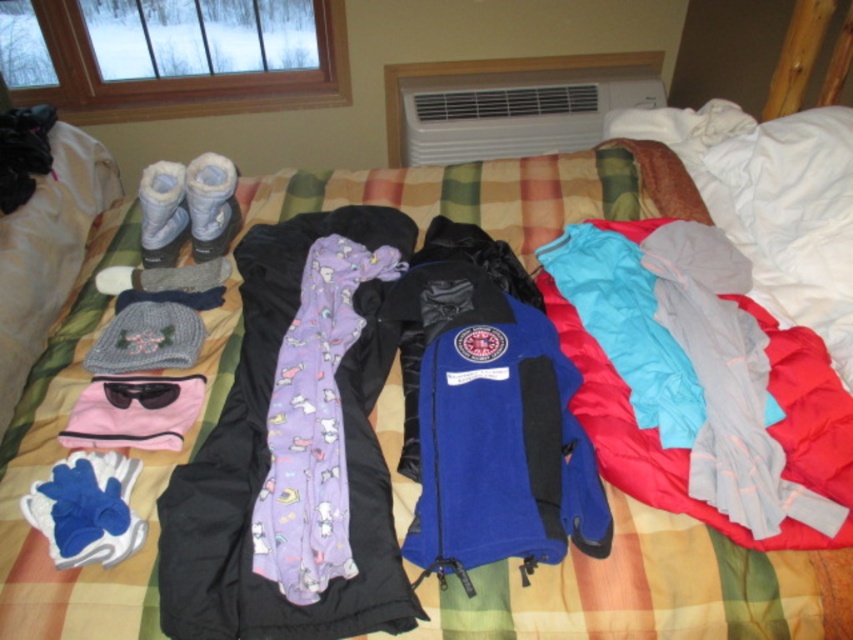
Which is below, purple fleece scarf at center or blue fleece jacket at center?

blue fleece jacket at center is lower down.

Does point (312, 545) come closer to viewer compared to point (514, 461)?

Yes.

In order to click on purple fleece scarf at center in this screenshot , I will do `click(296, 449)`.

Does light blue fabric at center have a lesser height compared to blue fleece jacket at center?

In fact, light blue fabric at center may be taller than blue fleece jacket at center.

Is point (670, 339) positioned in front of point (450, 570)?

No, (670, 339) is behind (450, 570).

Does point (548, 285) lie in front of point (572, 524)?

No.

Where is `light blue fabric at center`? light blue fabric at center is located at coordinates (700, 385).

Which of these two, purple fleece scarf at center or light blue fabric at center, stands shorter?

Standing shorter between the two is light blue fabric at center.

Locate an element on the screen. The width and height of the screenshot is (853, 640). purple fleece scarf at center is located at coordinates (296, 449).